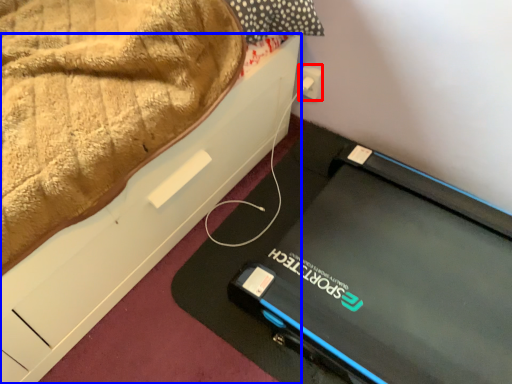
Question: Which object appears farthest to the camera in this image, electric outlet (highlighted by a red box) or furniture (highlighted by a blue box)?

Choices:
 (A) electric outlet
 (B) furniture

Answer: (A)